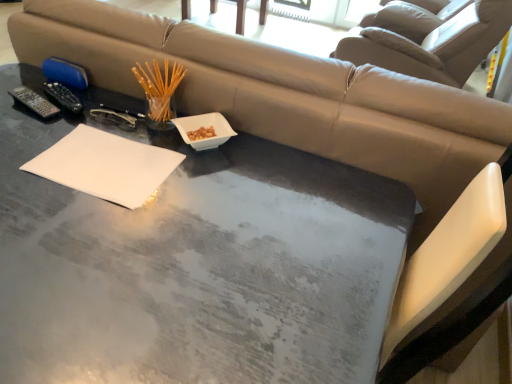
What are the coordinates of `free location to the right of white ceramic bowl at center` in the screenshot? It's located at (268, 159).